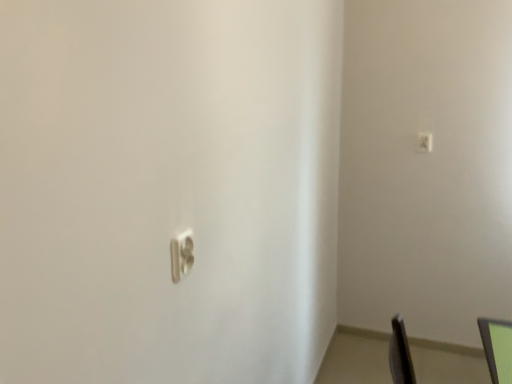
Question: Is green matte monitor at lower right at the left side of white plastic light switch at center, the 1th light switch positioned from the front?

Choices:
 (A) yes
 (B) no

Answer: (B)

Question: Is green matte monitor at lower right closer to the viewer compared to white plastic light switch at center, the 1th light switch when ordered from left to right?

Choices:
 (A) no
 (B) yes

Answer: (B)

Question: Is green matte monitor at lower right outside of white plastic light switch at center, arranged as the 2th light switch when viewed from the right?

Choices:
 (A) no
 (B) yes

Answer: (B)

Question: Is green matte monitor at lower right next to white plastic light switch at center, the first light switch from the bottom?

Choices:
 (A) yes
 (B) no

Answer: (B)

Question: From a real-world perspective, is green matte monitor at lower right located higher than white plastic light switch at center, the 2th light switch viewed from the top?

Choices:
 (A) no
 (B) yes

Answer: (A)

Question: Is green matte monitor at lower right far from white plastic light switch at center, the first light switch from the bottom?

Choices:
 (A) no
 (B) yes

Answer: (A)

Question: From the image's perspective, is satin silver switch at upper right, which is the 1th light switch in right-to-left order, below green matte monitor at lower right?

Choices:
 (A) yes
 (B) no

Answer: (B)

Question: Considering the relative positions of satin silver switch at upper right, the 2th light switch when ordered from front to back, and green matte monitor at lower right in the image provided, is satin silver switch at upper right, the 2th light switch when ordered from front to back, to the left of green matte monitor at lower right from the viewer's perspective?

Choices:
 (A) yes
 (B) no

Answer: (B)

Question: From the image's perspective, is satin silver switch at upper right, the 2th light switch viewed from the left, above green matte monitor at lower right?

Choices:
 (A) yes
 (B) no

Answer: (A)

Question: Can you confirm if satin silver switch at upper right, the 2th light switch when ordered from front to back, is smaller than green matte monitor at lower right?

Choices:
 (A) yes
 (B) no

Answer: (A)

Question: Is green matte monitor at lower right a part of satin silver switch at upper right, the 1th light switch viewed from the top?

Choices:
 (A) yes
 (B) no

Answer: (B)

Question: Is satin silver switch at upper right, the 2th light switch in the bottom-to-top sequence, outside of green matte monitor at lower right?

Choices:
 (A) yes
 (B) no

Answer: (A)

Question: Is green matte monitor at lower right not near satin silver switch at upper right, the 1th light switch viewed from the top?

Choices:
 (A) yes
 (B) no

Answer: (A)